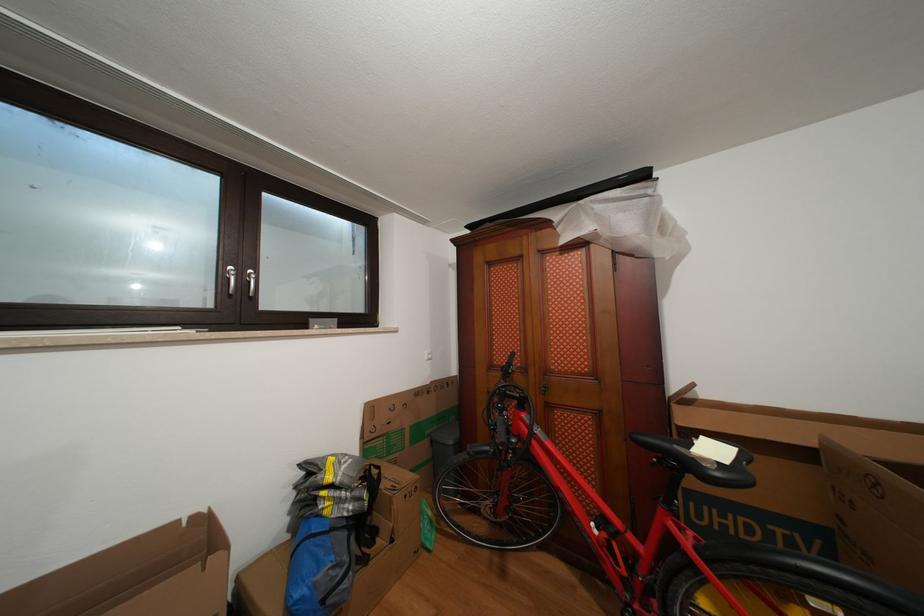
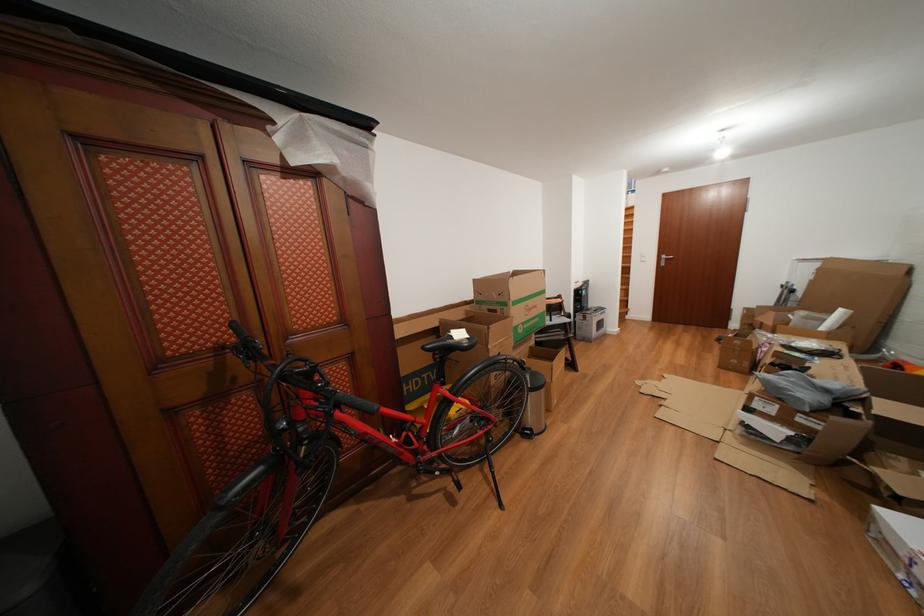
Where in the second image is the point corresponding to point 511,376 from the first image?

(248, 358)